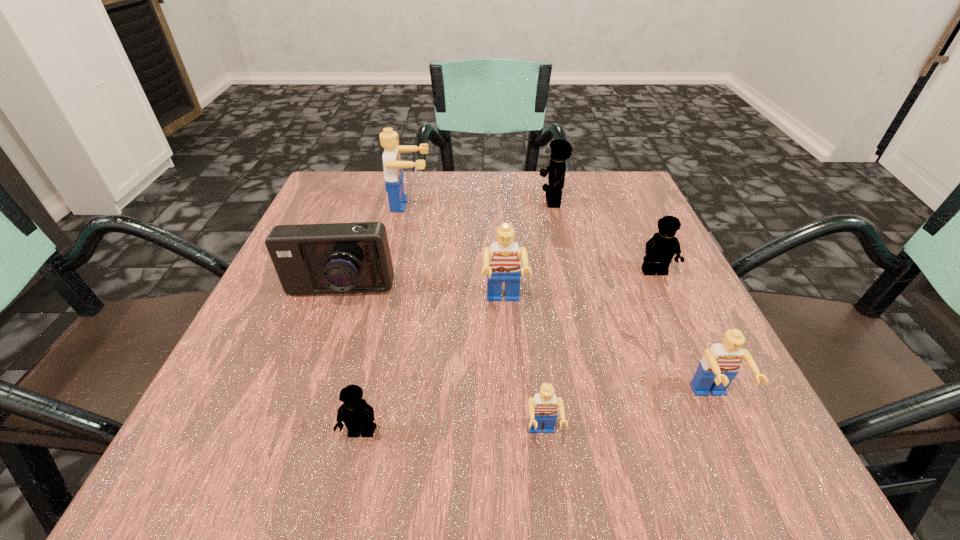
Locate an element on the screen. The height and width of the screenshot is (540, 960). free space between the nearest blue Lego and the camera is located at coordinates (441, 364).

Find the location of `empty space between the smallest yellow Lego and the third smallest blue Lego`. empty space between the smallest yellow Lego and the third smallest blue Lego is located at coordinates (432, 368).

Find the location of a particular element. This screenshot has width=960, height=540. vacant point located between the third nearest Lego and the second yellow Lego from right to left is located at coordinates (632, 301).

Where is `vacant area that lies between the third smallest blue Lego and the smallest yellow Lego`? The width and height of the screenshot is (960, 540). vacant area that lies between the third smallest blue Lego and the smallest yellow Lego is located at coordinates (432, 368).

The height and width of the screenshot is (540, 960). What are the coordinates of `free area in between the smallest yellow Lego and the blue camera` in the screenshot? It's located at (350, 363).

You are a GUI agent. You are given a task and a screenshot of the screen. Output one action in this format:
    pyautogui.click(x=<x>, y=<y>)
    Task: Click on the free space that is in between the second smallest blue Lego and the third nearest blue Lego
    The image size is (960, 540).
    Given the screenshot: What is the action you would take?
    pyautogui.click(x=608, y=352)

This screenshot has height=540, width=960. What are the coordinates of `vacant space that is in between the tallest object and the fifth Lego from left to right` in the screenshot? It's located at (481, 203).

Where is `free space between the second yellow Lego from right to left and the sixth farthest object`? free space between the second yellow Lego from right to left and the sixth farthest object is located at coordinates (632, 301).

Locate which object ranks seventh in proximity to the smallest blue Lego. Please provide its 2D coordinates. Your answer should be formatted as a tuple, i.e. [(x, y)], where the tuple contains the x and y coordinates of a point satisfying the conditions above.

[(393, 167)]

You are a GUI agent. You are given a task and a screenshot of the screen. Output one action in this format:
    pyautogui.click(x=<x>, y=<y>)
    Task: Click on the second closest object to the fifth nearest Lego
    
    Given the screenshot: What is the action you would take?
    click(501, 262)